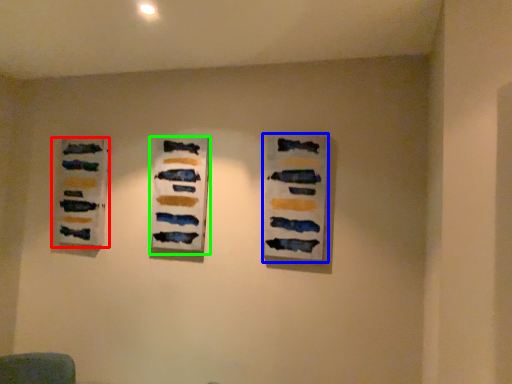
Question: Estimate the real-world distances between objects in this image. Which object is farther from art exhibition (highlighted by a red box), art exhibition (highlighted by a blue box) or art exhibition (highlighted by a green box)?

Choices:
 (A) art exhibition
 (B) art exhibition

Answer: (A)